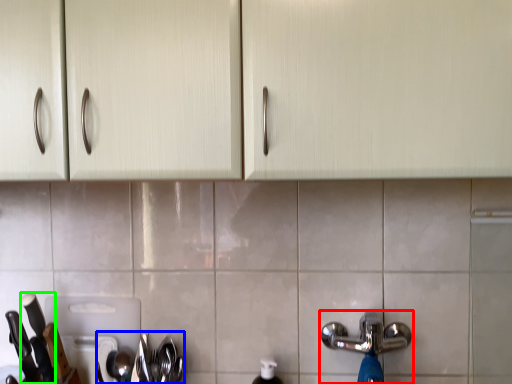
Question: Estimate the real-world distances between objects in this image. Which object is farther from tap (highlighted by a red box), silverware (highlighted by a blue box) or knife (highlighted by a green box)?

Choices:
 (A) silverware
 (B) knife

Answer: (B)